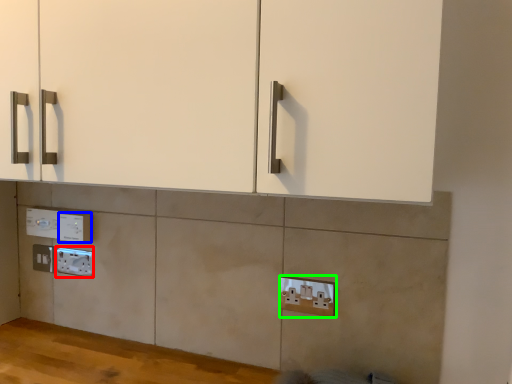
Question: Which object is positioned closest to electric outlet (highlighted by a red box)? Select from electric outlet (highlighted by a blue box) and electric outlet (highlighted by a green box).

Choices:
 (A) electric outlet
 (B) electric outlet

Answer: (A)